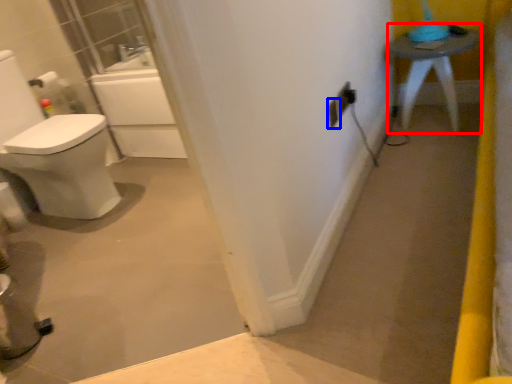
Question: Which object appears farthest to the camera in this image, furniture (highlighted by a red box) or electric outlet (highlighted by a blue box)?

Choices:
 (A) furniture
 (B) electric outlet

Answer: (A)